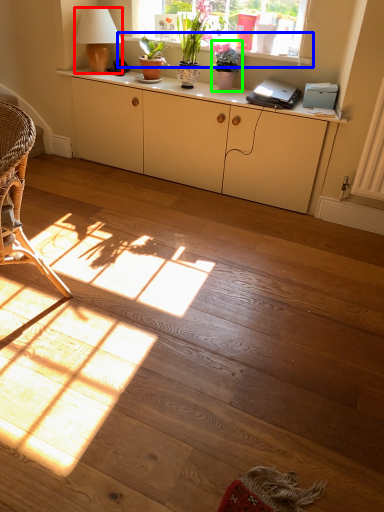
Question: Estimate the real-world distances between objects in this image. Which object is closer to lamp (highlighted by a red box), window sill (highlighted by a blue box) or houseplant (highlighted by a green box)?

Choices:
 (A) window sill
 (B) houseplant

Answer: (B)